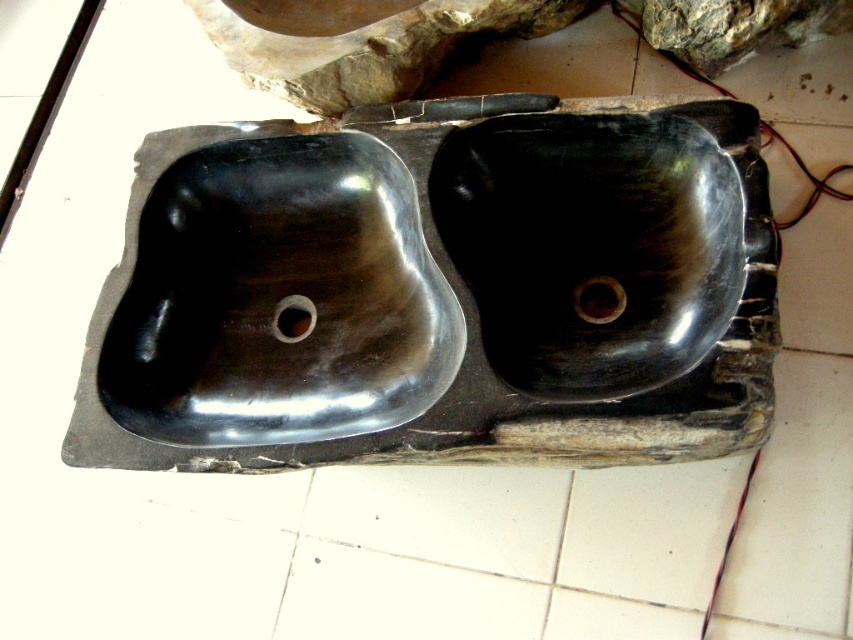
Question: Which point is closer to the camera taking this photo?

Choices:
 (A) (311, 58)
 (B) (280, 324)
 (C) (408, 148)

Answer: (C)

Question: Can you confirm if black polished sinks at center is positioned to the left of black marble stone at upper center?

Choices:
 (A) yes
 (B) no

Answer: (B)

Question: Which point is farther to the camera?

Choices:
 (A) black polished sinks at center
 (B) matte black drain at center
 (C) black polished stone sink at center
 (D) black polished sink at center

Answer: (B)

Question: Is black polished sink at center thinner than black marble stone at upper center?

Choices:
 (A) yes
 (B) no

Answer: (A)

Question: Is black rubber drain at center thinner than matte black drain at center?

Choices:
 (A) yes
 (B) no

Answer: (B)

Question: Which of the following is the farthest from the observer?

Choices:
 (A) black polished sinks at center
 (B) black marble stone at upper center
 (C) black polished stone sink at center

Answer: (B)